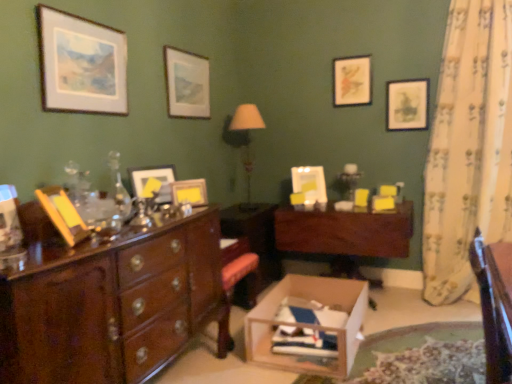
Question: Does matte gold picture frame at upper right, the 1th picture frame in the back-to-front sequence, have a smaller size compared to matte white picture frame at upper left, acting as the 6th picture frame starting from the right?

Choices:
 (A) yes
 (B) no

Answer: (A)

Question: Does matte gold picture frame at upper right, the 1th picture frame in the back-to-front sequence, have a lesser height compared to matte white picture frame at upper left, which appears as the first picture frame when viewed from the front?

Choices:
 (A) yes
 (B) no

Answer: (A)

Question: Is matte gold picture frame at upper right, the 1th picture frame in the back-to-front sequence, at the left side of matte white picture frame at upper left, acting as the 6th picture frame starting from the right?

Choices:
 (A) yes
 (B) no

Answer: (B)

Question: From a real-world perspective, is matte gold picture frame at upper right, placed as the 6th picture frame when sorted from front to back, located higher than matte white picture frame at upper left, which is counted as the 6th picture frame, starting from the back?

Choices:
 (A) no
 (B) yes

Answer: (B)

Question: Could you tell me if matte gold picture frame at upper right, placed as the 5th picture frame when sorted from left to right, is facing matte white picture frame at upper left, which is counted as the 6th picture frame, starting from the back?

Choices:
 (A) no
 (B) yes

Answer: (A)

Question: Is wooden cardboard box at center wider or thinner than shiny brown wooden chest of drawers at left?

Choices:
 (A) wide
 (B) thin

Answer: (A)

Question: Relative to shiny brown wooden chest of drawers at left, is wooden cardboard box at center in front or behind?

Choices:
 (A) front
 (B) behind

Answer: (B)

Question: From their relative heights in the image, would you say wooden cardboard box at center is taller or shorter than shiny brown wooden chest of drawers at left?

Choices:
 (A) short
 (B) tall

Answer: (A)

Question: From a real-world perspective, relative to shiny brown wooden chest of drawers at left, is wooden cardboard box at center vertically above or below?

Choices:
 (A) below
 (B) above

Answer: (A)

Question: In the image, is mahogany wood desk at center positioned in front of or behind mahogany wood desk at center?

Choices:
 (A) front
 (B) behind

Answer: (A)

Question: From the image's perspective, is mahogany wood desk at center above or below mahogany wood desk at center?

Choices:
 (A) above
 (B) below

Answer: (A)

Question: Visually, is mahogany wood desk at center positioned to the left or to the right of mahogany wood desk at center?

Choices:
 (A) right
 (B) left

Answer: (A)

Question: Is point (370, 246) positioned closer to the camera than point (260, 251)?

Choices:
 (A) farther
 (B) closer

Answer: (B)

Question: Is mahogany wood desk at center inside the boundaries of matte gold picture frame at center, which ranks as the 3th picture frame in right-to-left order, or outside?

Choices:
 (A) inside
 (B) outside

Answer: (B)

Question: In terms of size, does mahogany wood desk at center appear bigger or smaller than matte gold picture frame at center, the second picture frame in the front-to-back sequence?

Choices:
 (A) big
 (B) small

Answer: (A)